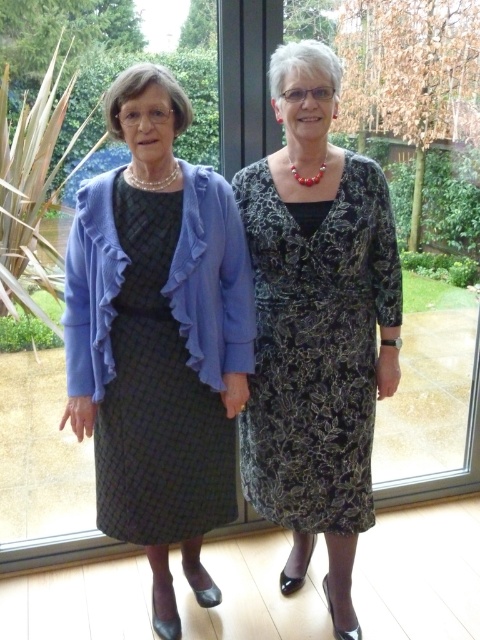
Is matte blue cardigan at left bigger than black textured dress at center?

Indeed, matte blue cardigan at left has a larger size compared to black textured dress at center.

Looking at this image, is matte blue cardigan at left behind black textured dress at center?

No, matte blue cardigan at left is closer to the viewer.

Between point (204, 440) and point (336, 452), which one is positioned in front?

Point (336, 452)

Identify the location of matte blue cardigan at left. (159, 337).

Can you confirm if matte blue cardigan at left is taller than black textured dress at left?

Yes, matte blue cardigan at left is taller than black textured dress at left.

The width and height of the screenshot is (480, 640). I want to click on matte blue cardigan at left, so click(x=159, y=337).

Is point (372, 422) positioned before point (96, 440)?

Yes, it is.

The image size is (480, 640). In order to click on matte blue cardigan at left in this screenshot , I will do `click(159, 337)`.

Locate an element on the screen. The width and height of the screenshot is (480, 640). black textured dress at center is located at coordinates (315, 346).

Which is below, black textured dress at center or black textured dress at left?

Positioned lower is black textured dress at left.

Does point (296, 282) come closer to viewer compared to point (154, 243)?

That is False.

You are a GUI agent. You are given a task and a screenshot of the screen. Output one action in this format:
    pyautogui.click(x=<x>, y=<y>)
    Task: Click on the black textured dress at center
    The height and width of the screenshot is (640, 480).
    Given the screenshot: What is the action you would take?
    pyautogui.click(x=315, y=346)